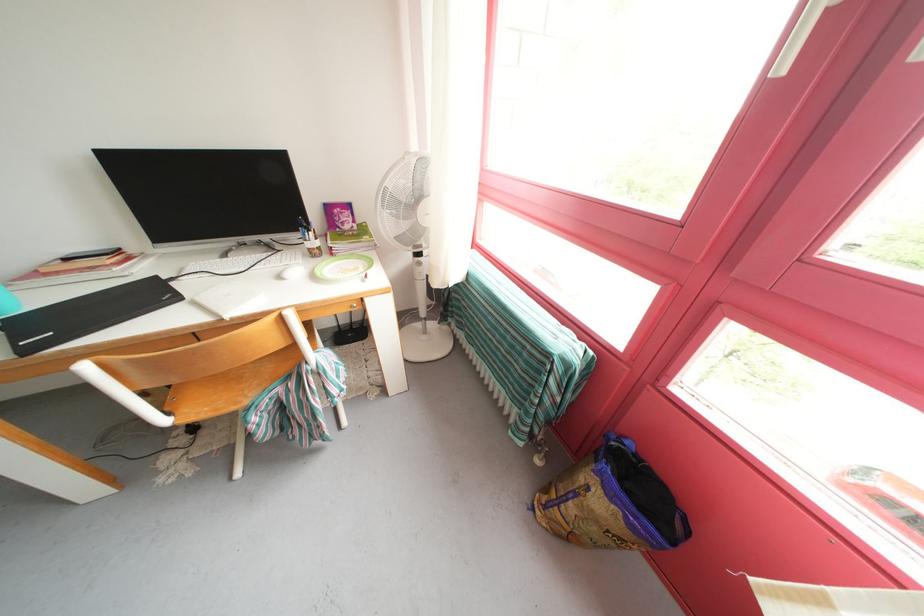
Describe the element at coordinates (796, 38) in the screenshot. The image size is (924, 616). I see `a white window handle` at that location.